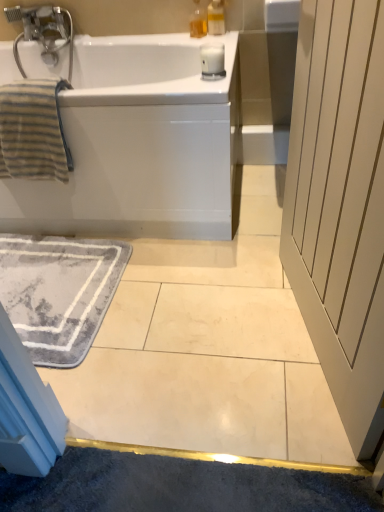
Image resolution: width=384 pixels, height=512 pixels. In order to click on vacant space that's between white wood screen door at right and gray soft rug at lower left in this screenshot , I will do `click(200, 339)`.